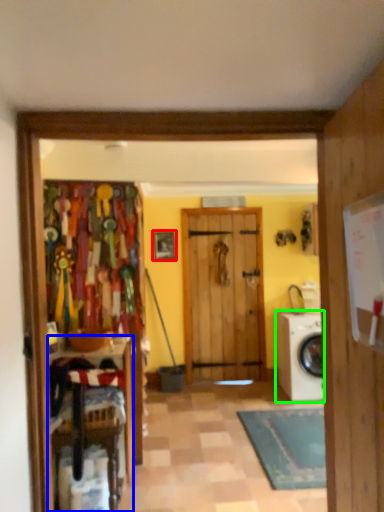
Question: Which object is positioned closest to picture frame (highlighted by a red box)? Select from furniture (highlighted by a blue box) and washing machine (highlighted by a green box).

Choices:
 (A) furniture
 (B) washing machine

Answer: (B)